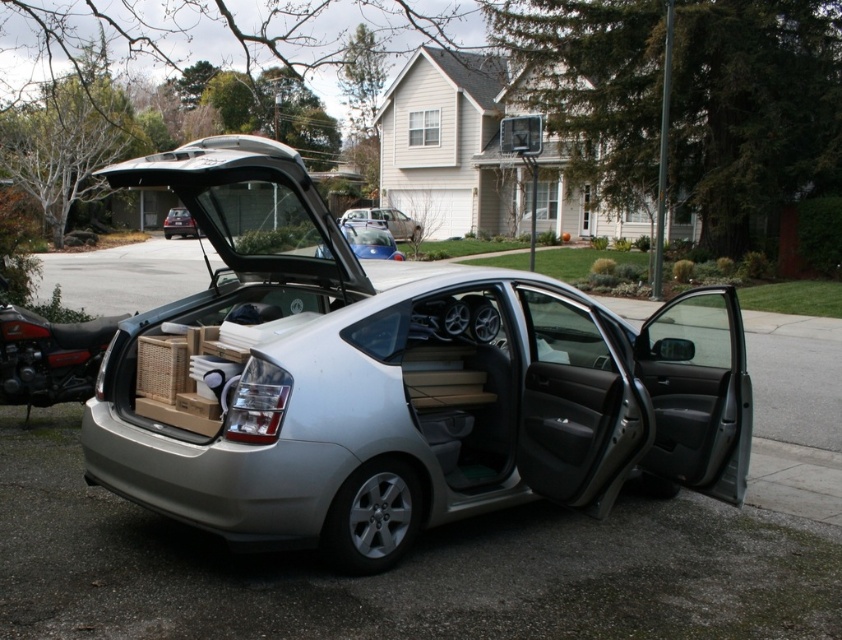
Question: Is satin blue sedan at center wider than matte black car at center?

Choices:
 (A) no
 (B) yes

Answer: (A)

Question: Which is nearer to the matte black car at center?

Choices:
 (A) satin silver sedan at center
 (B) satin blue sedan at center

Answer: (B)

Question: Can you confirm if satin silver sedan at center is smaller than satin blue sedan at center?

Choices:
 (A) no
 (B) yes

Answer: (A)

Question: Observing the image, what is the correct spatial positioning of satin blue sedan at center in reference to matte black car at center?

Choices:
 (A) below
 (B) above

Answer: (A)

Question: Which of the following is the farthest from the observer?

Choices:
 (A) (179, 227)
 (B) (158, 512)

Answer: (A)

Question: Which object is positioned farthest from the satin blue sedan at center?

Choices:
 (A) matte black car at center
 (B) satin silver sedan at center

Answer: (A)